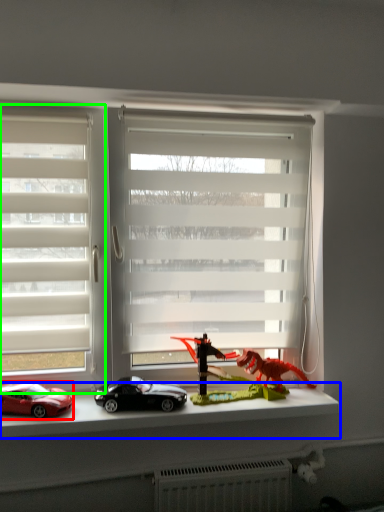
Question: Which object is the closest to the car (highlighted by a red box)? Choose among these: window sill (highlighted by a blue box) or window (highlighted by a green box).

Choices:
 (A) window sill
 (B) window

Answer: (A)